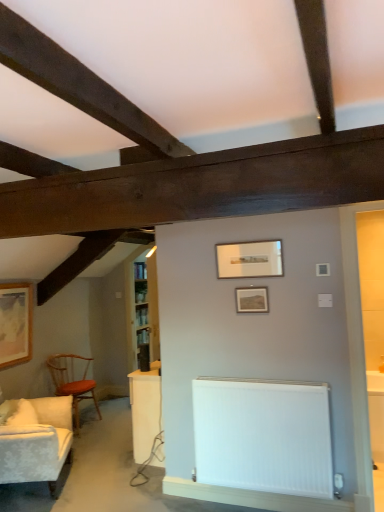
Find the location of a particular element. vacant area that lies to the right of wooden polished chair at left is located at coordinates (114, 425).